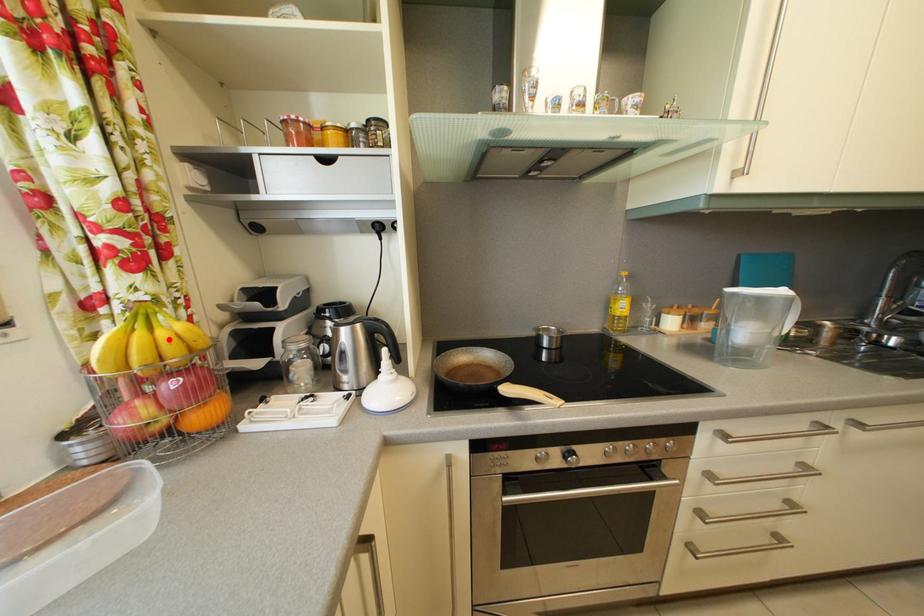
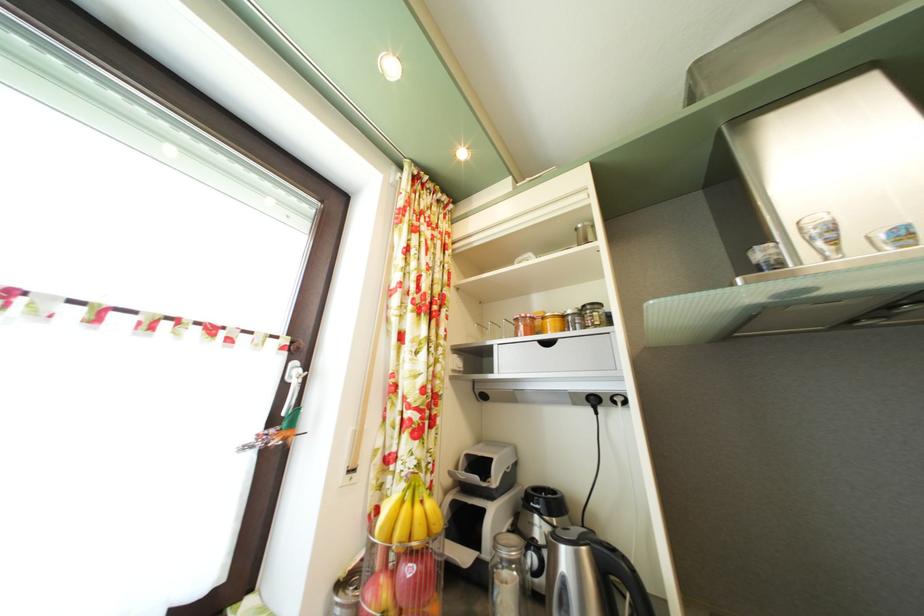
Question: I am providing you with two images of the same scene from different viewpoints. A red point is marked on the first image. At the location where the point appears in image 1, is it still visible in image 2?

Choices:
 (A) Yes
 (B) No

Answer: (A)